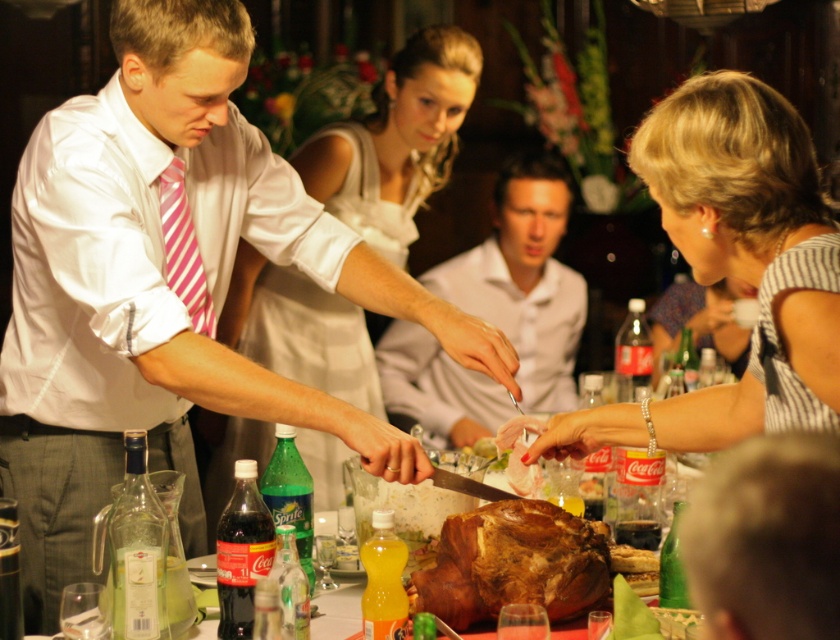
Question: Does silky white dress at center appear on the right side of white matte shirt at center?

Choices:
 (A) no
 (B) yes

Answer: (A)

Question: Does silky white dress at center appear over translucent orange juice at center?

Choices:
 (A) no
 (B) yes

Answer: (B)

Question: Is white satin shirt at center smaller than striped fabric dress at right?

Choices:
 (A) no
 (B) yes

Answer: (A)

Question: Which of the following is the farthest from the observer?

Choices:
 (A) (627, 576)
 (B) (365, 134)
 (C) (376, 577)

Answer: (B)

Question: Which object appears closest to the camera in this image?

Choices:
 (A) brown/crusty roasted meat at center
 (B) dark red plastic coca-cola bottle at lower left
 (C) translucent orange juice at center
 (D) silky white dress at center

Answer: (C)

Question: Which point is farther to the camera?

Choices:
 (A) white matte shirt at center
 (B) brown/crusty roasted meat at center
 (C) white satin shirt at center

Answer: (A)